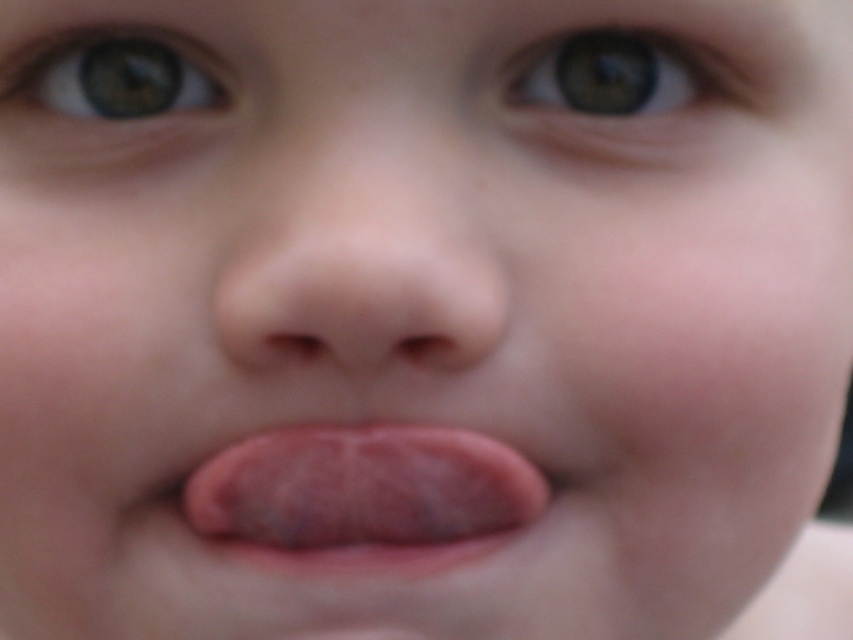
Question: Which point is closer to the camera?

Choices:
 (A) (444, 557)
 (B) (679, 42)

Answer: (A)

Question: Which point is farther from the camera taking this photo?

Choices:
 (A) 163,116
 (B) 247,285

Answer: (A)

Question: Which object is the farthest from the green matte eye at upper left?

Choices:
 (A) pink flesh-colored tongue at center
 (B) smooth flesh-colored nose at center

Answer: (A)

Question: Can you confirm if smooth flesh-colored nose at center is thinner than pink flesh-colored tongue at center?

Choices:
 (A) no
 (B) yes

Answer: (B)

Question: From the image, what is the correct spatial relationship of pink flesh-colored tongue at center in relation to green matte eye at upper left?

Choices:
 (A) below
 (B) above

Answer: (A)

Question: Is smooth flesh-colored nose at center bigger than green matte eye at upper center?

Choices:
 (A) no
 (B) yes

Answer: (B)